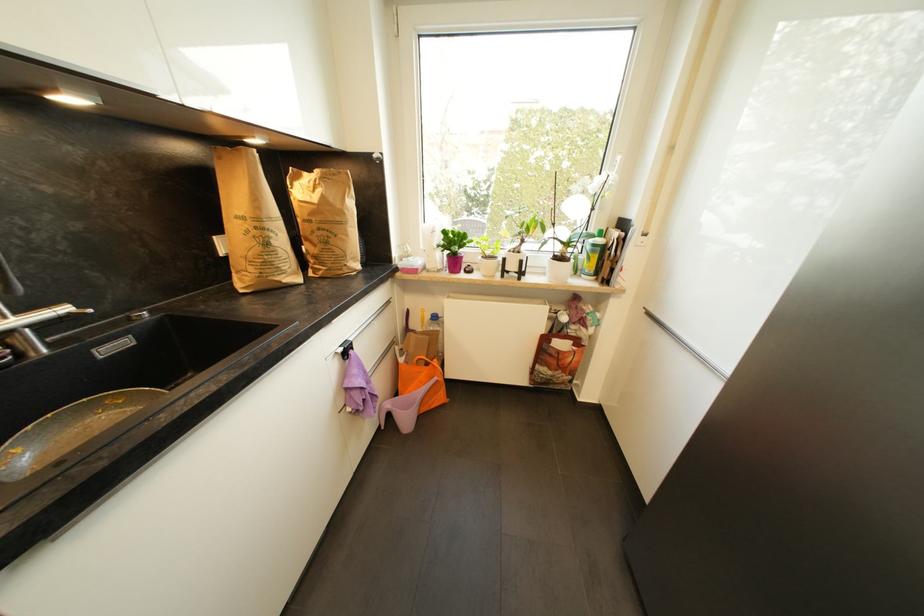
Where is `white drawer handle`? Image resolution: width=924 pixels, height=616 pixels. white drawer handle is located at coordinates (369, 321).